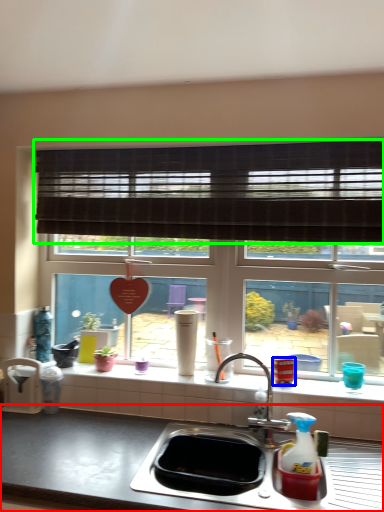
Question: Which is farther away from countertop (highlighted by a red box)? appliance (highlighted by a blue box) or window blind (highlighted by a green box)?

Choices:
 (A) appliance
 (B) window blind

Answer: (B)